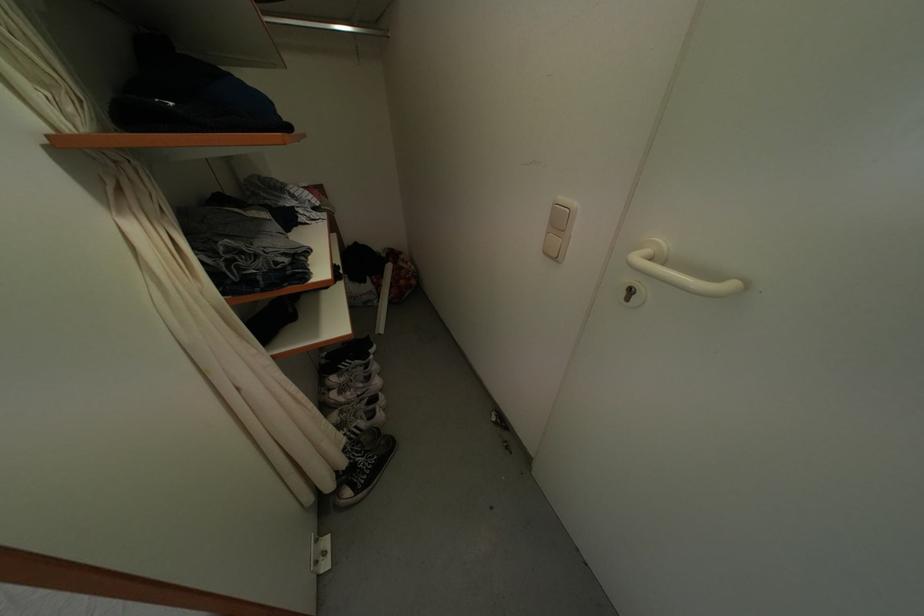
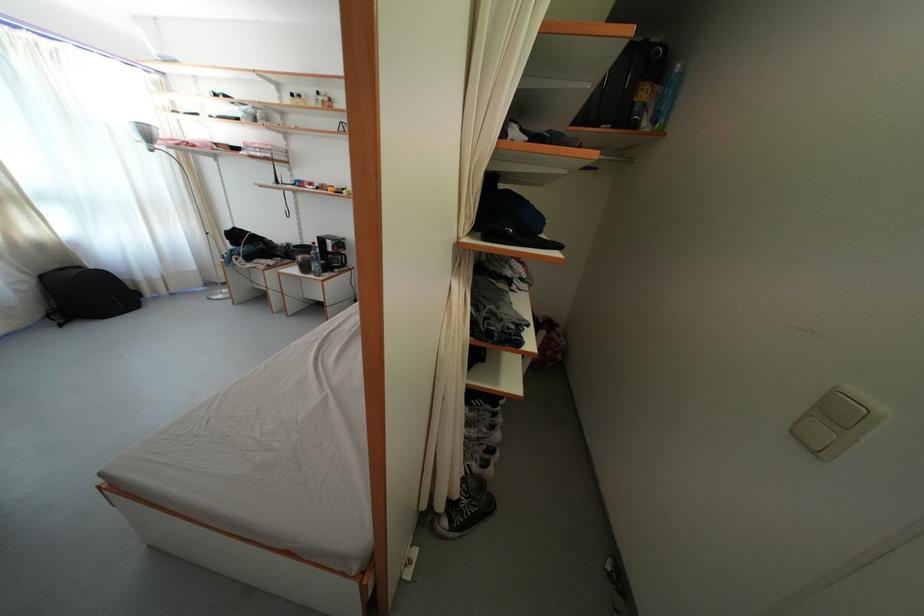
Question: The images are taken continuously from a first-person perspective. In which direction is your viewpoint rotating?

Choices:
 (A) Left
 (B) Right
 (C) Up
 (D) Down

Answer: (A)